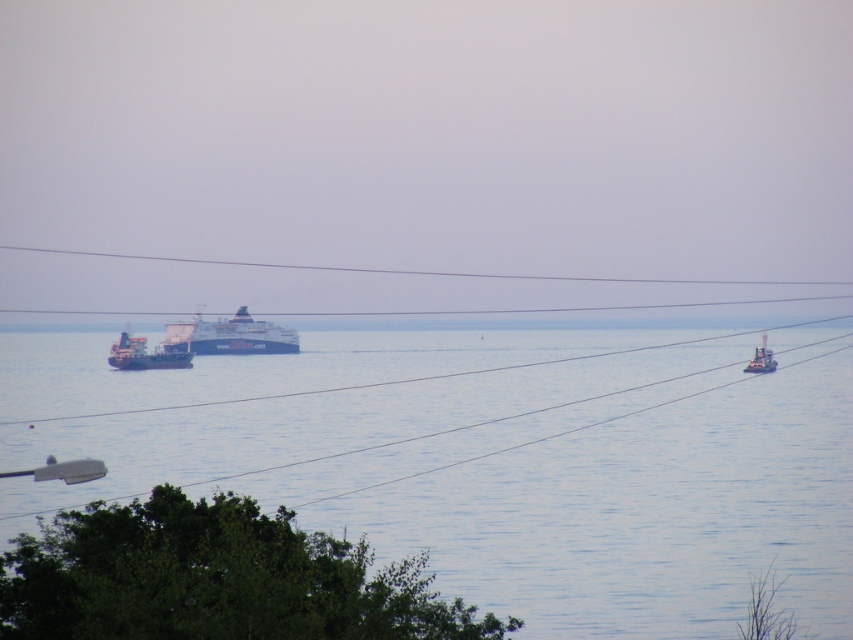
Question: Which object appears farthest from the camera in this image?

Choices:
 (A) metallic gray boat at right
 (B) blue metallic ship at center
 (C) green matte cargo ship at center
 (D) blue water at center

Answer: (B)

Question: Does blue water at center have a smaller size compared to blue metallic ship at center?

Choices:
 (A) yes
 (B) no

Answer: (B)

Question: Does blue water at center appear over metallic gray boat at right?

Choices:
 (A) no
 (B) yes

Answer: (A)

Question: Is blue water at center further to camera compared to green matte cargo ship at center?

Choices:
 (A) yes
 (B) no

Answer: (B)

Question: Which object is positioned closest to the metallic gray boat at right?

Choices:
 (A) blue metallic ship at center
 (B) green matte cargo ship at center
 (C) blue water at center

Answer: (C)

Question: Which point is closer to the camera?

Choices:
 (A) metallic gray boat at right
 (B) green matte cargo ship at center
 (C) blue water at center
 (D) blue metallic ship at center

Answer: (C)